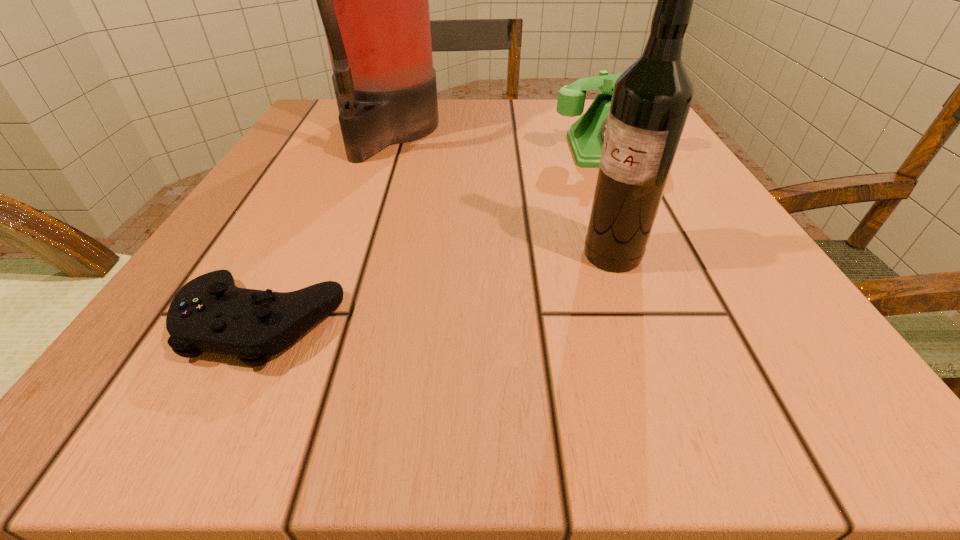
This screenshot has height=540, width=960. I want to click on object at the near left corner, so click(210, 313).

Where is `object at the far right corner`? object at the far right corner is located at coordinates pyautogui.click(x=586, y=136).

Locate an element on the screen. This screenshot has height=540, width=960. vacant space at the far edge of the desktop is located at coordinates (474, 146).

This screenshot has width=960, height=540. In order to click on free region at the near edge of the desktop in this screenshot , I will do `click(601, 401)`.

Where is `vacant position at the left edge of the desktop`? The height and width of the screenshot is (540, 960). vacant position at the left edge of the desktop is located at coordinates (292, 258).

The width and height of the screenshot is (960, 540). In order to click on vacant region at the right edge of the desktop in this screenshot , I will do `click(808, 337)`.

Find the location of a particular element. This screenshot has height=540, width=960. vacant area at the far left corner of the desktop is located at coordinates (332, 141).

In the image, there is a desktop. Where is `vacant space at the near left corner`? vacant space at the near left corner is located at coordinates (256, 387).

At what (x,y) coordinates should I click in order to perform the action: click on free point at the near right corner. Please return your answer as a coordinate pair (x, y). Looking at the image, I should click on (771, 413).

Where is `vacant space in between the third tallest object and the nearest object`? vacant space in between the third tallest object and the nearest object is located at coordinates (436, 236).